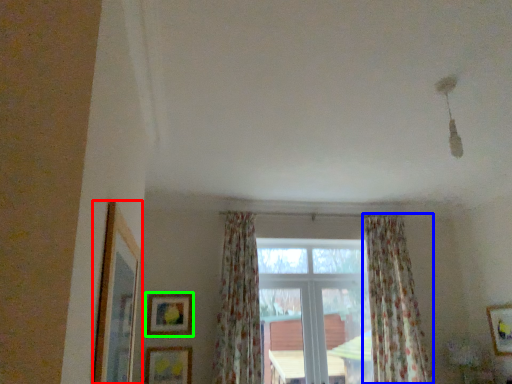
Question: Which object is the farthest from picture frame (highlighted by a red box)? Choose among these: curtain (highlighted by a blue box) or picture frame (highlighted by a green box).

Choices:
 (A) curtain
 (B) picture frame

Answer: (A)